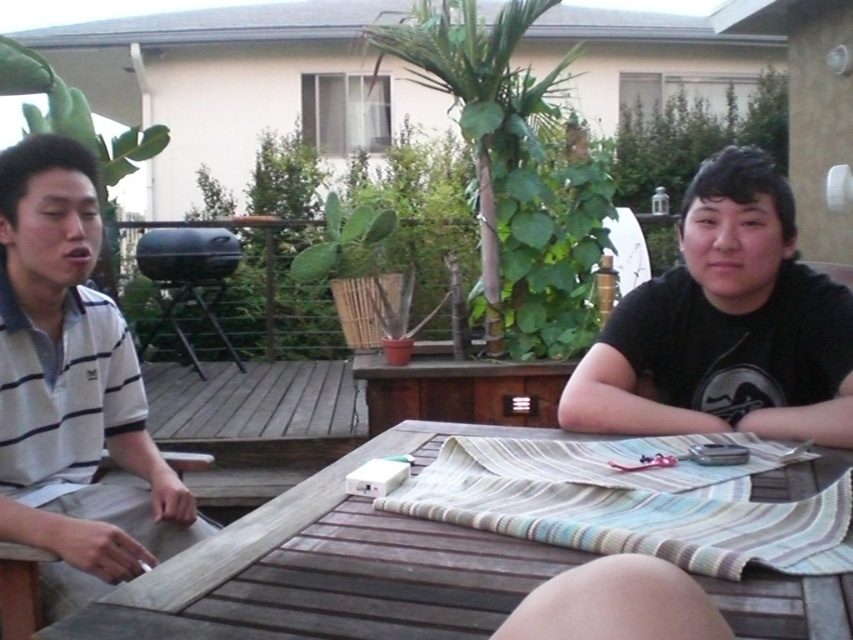
You are a delivery robot that needs to place a package between the wooden table at center and the white striped polo shirt at left. The package is 50 centimeters long. Will it fit in the space between them?

The distance between the wooden table at center and the white striped polo shirt at left is 53.16 centimeters. Since the package is 50 centimeters long, it will fit with approximately 3.16 centimeters of space remaining.

What object is located at the coordinate point (x=335, y=566) in the image?

The wooden table at center is located at the coordinate point (x=335, y=566).

You are standing at the edge of the patio and want to place a small plant pot between the wooden table at center and the black matte shirt at right. According to the scene, where should you position the plant pot?

The wooden table at center is to the left of the black matte shirt at right, so you should place the plant pot between the wooden table at center and the black matte shirt at right, ensuring it is positioned to the right of the wooden table at center and to the left of the black matte shirt at right.